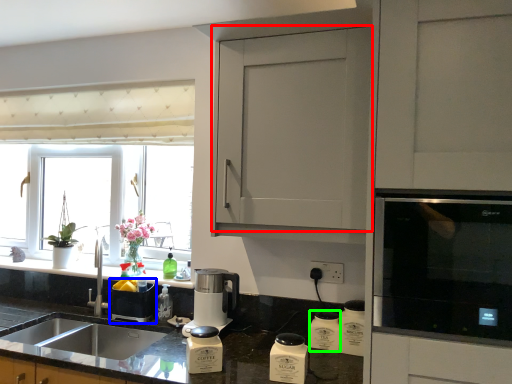
Question: Which object is the farthest from cabinetry (highlighted by a red box)? Choose among these: appliance (highlighted by a blue box) or appliance (highlighted by a green box).

Choices:
 (A) appliance
 (B) appliance

Answer: (A)